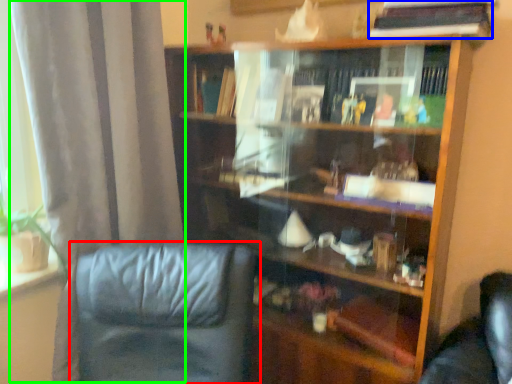
Question: Which object is positioned farthest from chair (highlighted by a red box)? Select from book (highlighted by a blue box) and curtain (highlighted by a green box).

Choices:
 (A) book
 (B) curtain

Answer: (A)